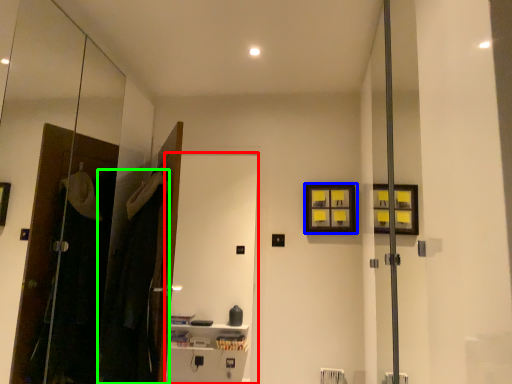
Question: Which object is the closest to the screen door (highlighted by a red box)? Choose among these: picture frame (highlighted by a blue box) or laundry (highlighted by a green box).

Choices:
 (A) picture frame
 (B) laundry

Answer: (A)